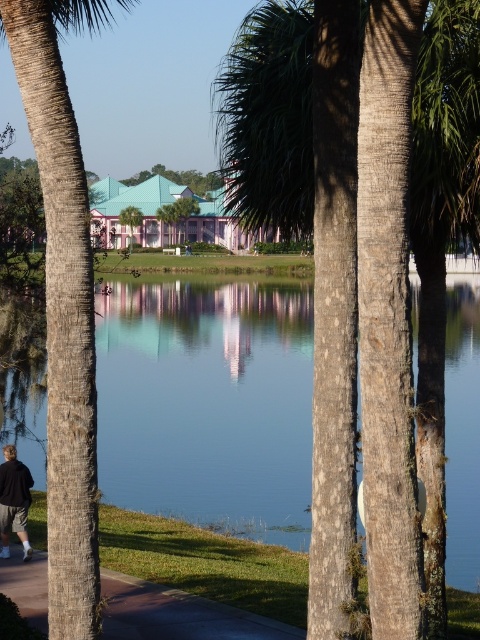
You are designing a pathway between the brown rough palm tree at center and the brown textured palm tree at left. If the pathway must be 2 meters wide, will there be enough space between them?

The brown rough palm tree at center has a larger width than the brown textured palm tree at left. However, the exact distance between them isn

You are a hiker planning to walk along the paved asphalt path at lower center while avoiding the black fabric person at lower left. Since the path is wider than the person, can you walk around them without stepping off the path?

The paved asphalt path at lower center is wider than the black fabric person at lower left, so yes, you can walk around them without leaving the path.

You are standing at the edge of the lake and want to take a photo of the brown rough palm tree at center. If your camera has a maximum zoom range of 5 meters, will you be able to capture the tree clearly without moving closer?

The brown rough palm tree at center is 5.50 meters away from the camera. Since the maximum zoom range is 5 meters, the camera cannot capture the tree clearly without moving closer.